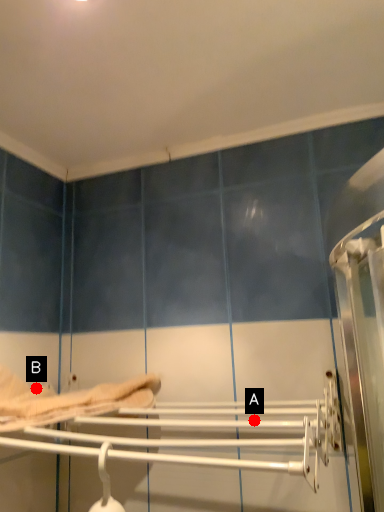
Question: Two points are circled on the image, labeled by A and B beside each circle. Which point is closer to the camera taking this photo?

Choices:
 (A) A is closer
 (B) B is closer

Answer: (A)